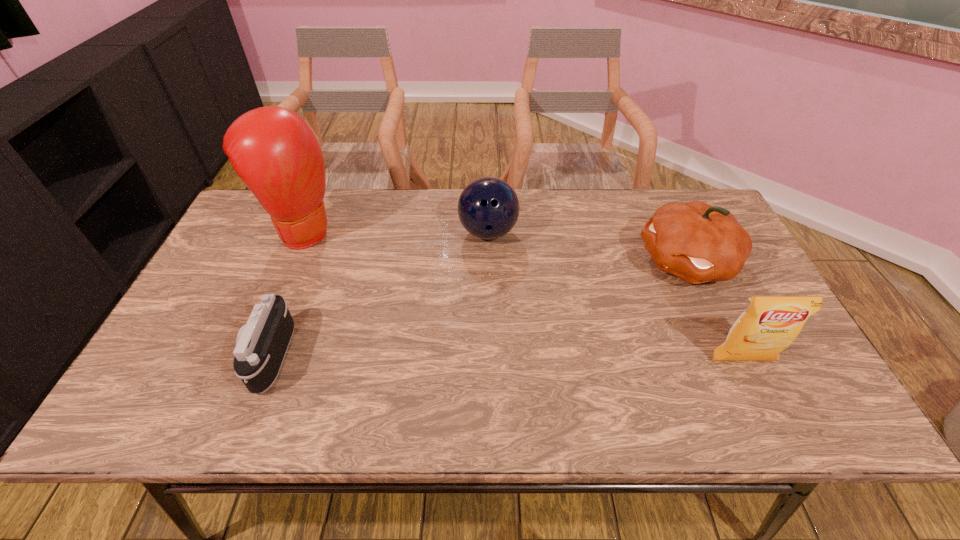
Find the location of a particular element. vacant space situated on the front face of the pumpkin is located at coordinates (615, 295).

At what (x,y) coordinates should I click in order to perform the action: click on vacant area located on the front face of the pumpkin. Please return your answer as a coordinate pair (x, y). This screenshot has width=960, height=540. Looking at the image, I should click on (579, 313).

The width and height of the screenshot is (960, 540). What are the coordinates of `vacant space located 0.350m on the striking surface of the tallest object` in the screenshot? It's located at (406, 314).

You are a GUI agent. You are given a task and a screenshot of the screen. Output one action in this format:
    pyautogui.click(x=<x>, y=<y>)
    Task: Click on the free region located on the striking surface of the tallest object
    The width and height of the screenshot is (960, 540).
    Given the screenshot: What is the action you would take?
    pyautogui.click(x=342, y=264)

Where is `vacant space situated on the striking surface of the tallest object`? The image size is (960, 540). vacant space situated on the striking surface of the tallest object is located at coordinates (362, 279).

Where is `free region located 0.300m on the surface of the second shortest object near the finger holes`? The image size is (960, 540). free region located 0.300m on the surface of the second shortest object near the finger holes is located at coordinates (540, 331).

Find the location of a particular element. blank space located on the surface of the second shortest object near the finger holes is located at coordinates (505, 265).

The image size is (960, 540). Find the location of `free spot located 0.140m on the surface of the second shortest object near the finger holes`. free spot located 0.140m on the surface of the second shortest object near the finger holes is located at coordinates (516, 285).

At what (x,y) coordinates should I click in order to perform the action: click on pumpkin situated at the far edge. Please return your answer as a coordinate pair (x, y). This screenshot has height=540, width=960. Looking at the image, I should click on (698, 243).

At what (x,y) coordinates should I click in order to perform the action: click on boxing glove positioned at the far edge. Please return your answer as a coordinate pair (x, y). Looking at the image, I should click on (272, 149).